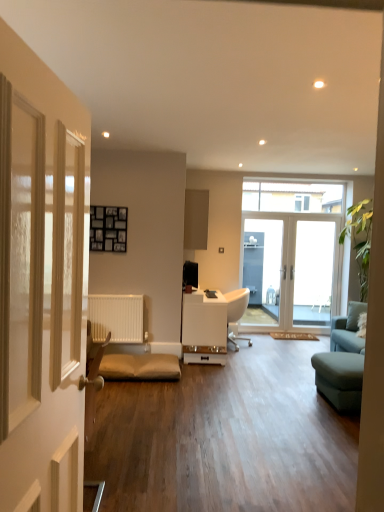
Question: Is matte gray cabinet at upper center not within white glossy door at center, the second door when ordered from left to right?

Choices:
 (A) yes
 (B) no

Answer: (A)

Question: Is matte gray cabinet at upper center facing towards white glossy door at center, the second door from the front?

Choices:
 (A) yes
 (B) no

Answer: (A)

Question: From the image's perspective, is matte gray cabinet at upper center above white glossy door at center, the first door positioned from the right?

Choices:
 (A) no
 (B) yes

Answer: (B)

Question: Is white glossy door at center, the first door positioned from the right, a part of matte gray cabinet at upper center?

Choices:
 (A) yes
 (B) no

Answer: (B)

Question: Is matte gray cabinet at upper center to the right of white glossy door at center, which is the 1th door in back-to-front order, from the viewer's perspective?

Choices:
 (A) yes
 (B) no

Answer: (B)

Question: Considering the relative sizes of matte gray cabinet at upper center and white glossy door at center, the second door from the front, in the image provided, is matte gray cabinet at upper center thinner than white glossy door at center, the second door from the front,?

Choices:
 (A) no
 (B) yes

Answer: (A)

Question: From the image's perspective, is transparent glass screen door at center on matte gray cabinet at upper center?

Choices:
 (A) no
 (B) yes

Answer: (A)

Question: Is the depth of transparent glass screen door at center less than that of matte gray cabinet at upper center?

Choices:
 (A) no
 (B) yes

Answer: (A)

Question: Is transparent glass screen door at center oriented towards matte gray cabinet at upper center?

Choices:
 (A) yes
 (B) no

Answer: (B)

Question: Is transparent glass screen door at center in contact with matte gray cabinet at upper center?

Choices:
 (A) yes
 (B) no

Answer: (B)

Question: Does transparent glass screen door at center appear on the right side of matte gray cabinet at upper center?

Choices:
 (A) no
 (B) yes

Answer: (B)

Question: Is matte gray cabinet at upper center located within transparent glass screen door at center?

Choices:
 (A) no
 (B) yes

Answer: (A)

Question: Is matte gray cabinet at upper center located within white glossy door at center, the second door from the front?

Choices:
 (A) yes
 (B) no

Answer: (B)